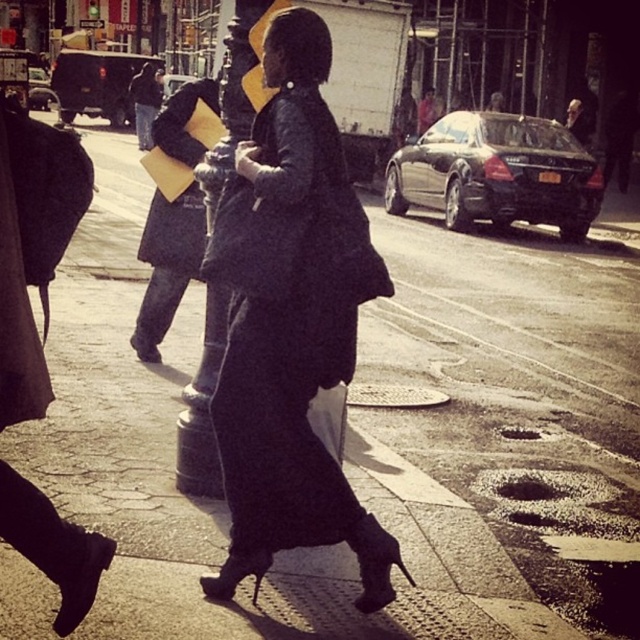
From the picture: Which of these two, black matte robe at center or matte black coat at center, stands taller?

matte black coat at center is taller.

Locate an element on the screen. The width and height of the screenshot is (640, 640). black matte robe at center is located at coordinates (x=289, y=324).